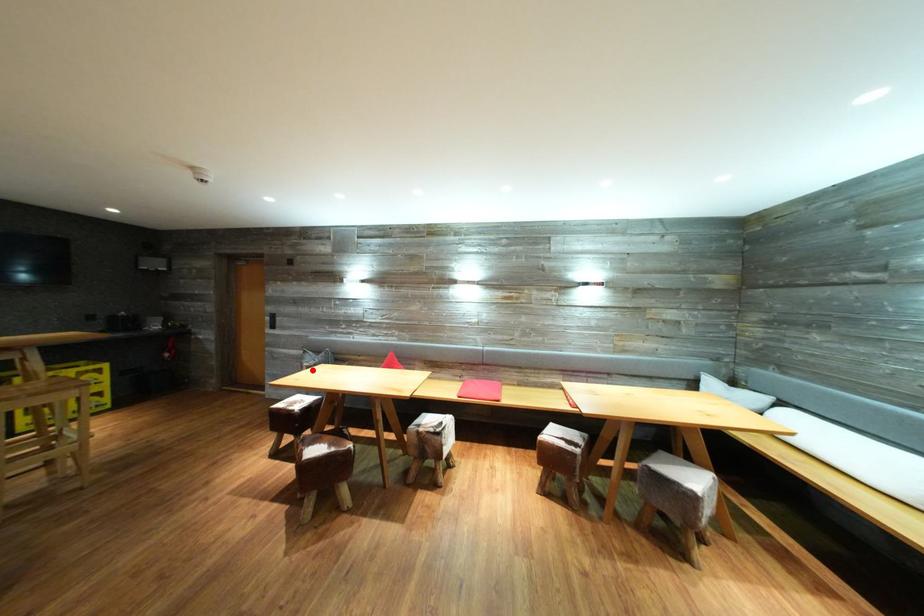
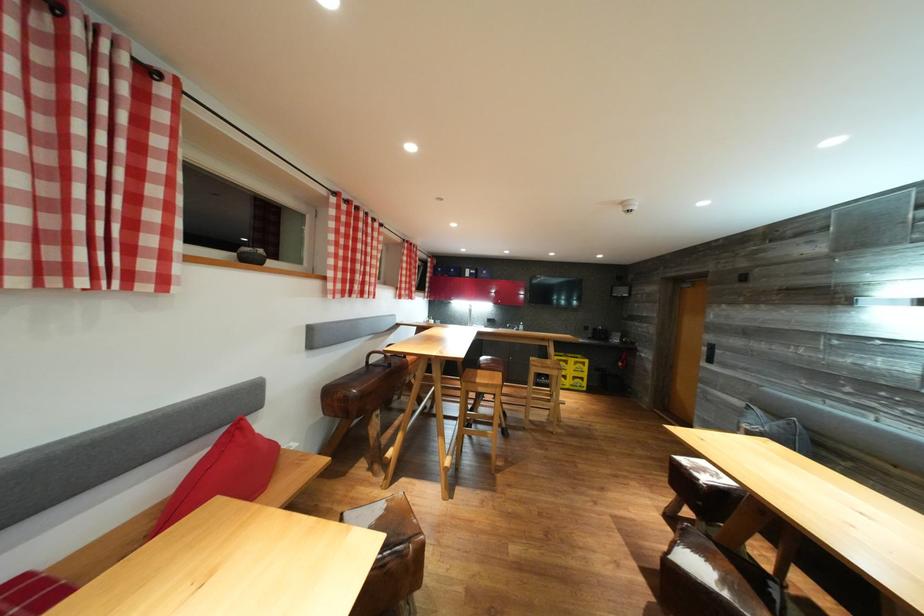
Locate, in the second image, the point that corresponds to the highlighted location in the first image.

(751, 431)